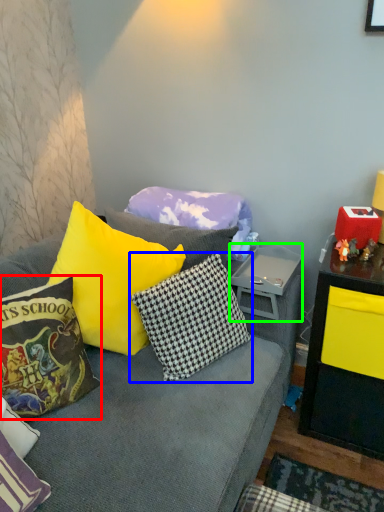
Question: Considering the real-world distances, which object is closest to pillow (highlighted by a red box)? pillow (highlighted by a blue box) or side table (highlighted by a green box).

Choices:
 (A) pillow
 (B) side table

Answer: (A)